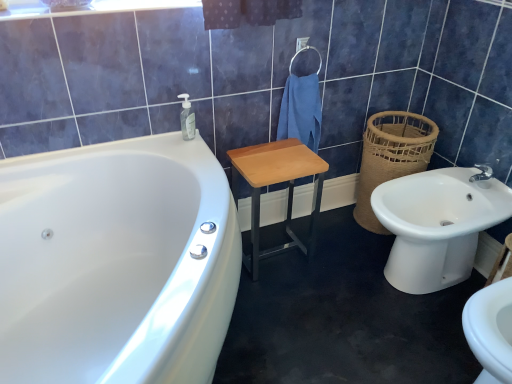
Find the location of a particular element. Image resolution: width=512 pixels, height=384 pixels. free space on the front side of translucent plastic soap dispenser at upper left is located at coordinates (188, 151).